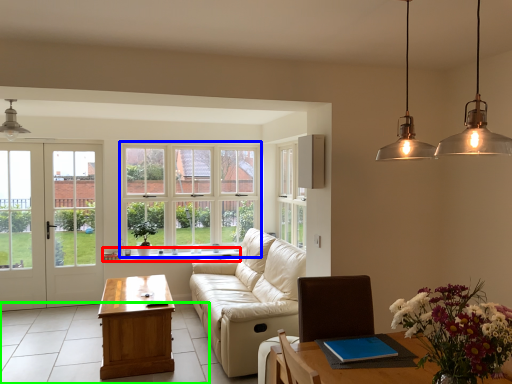
Question: Which object is positioned closest to window sill (highlighted by a red box)? Select from window (highlighted by a blue box) and tile (highlighted by a green box).

Choices:
 (A) window
 (B) tile

Answer: (A)